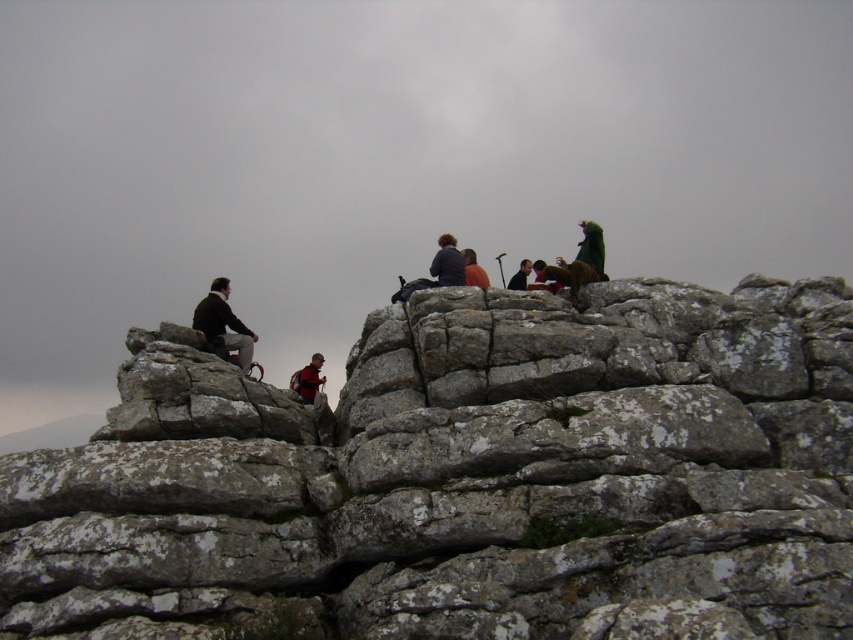
Question: Among these points, which one is farthest from the camera?

Choices:
 (A) (297, 392)
 (B) (430, 264)

Answer: (B)

Question: Is rough stone rock at center to the right of red fabric jacket at center from the viewer's perspective?

Choices:
 (A) no
 (B) yes

Answer: (B)

Question: Is matte gray backpack at center to the left of orange cotton shirt at center from the viewer's perspective?

Choices:
 (A) no
 (B) yes

Answer: (B)

Question: Which object appears closest to the camera in this image?

Choices:
 (A) green fuzzy costume at upper center
 (B) dark blue jacket at center
 (C) orange cotton shirt at center

Answer: (C)

Question: Which of the following is the closest to the observer?

Choices:
 (A) dark blue jacket at center
 (B) green fuzzy costume at upper center
 (C) rough stone rock at center
 (D) dark brown leather jacket at left

Answer: (C)

Question: From the image, what is the correct spatial relationship of rough stone rock at center in relation to dark brown leather jacket at left?

Choices:
 (A) right
 (B) left

Answer: (A)